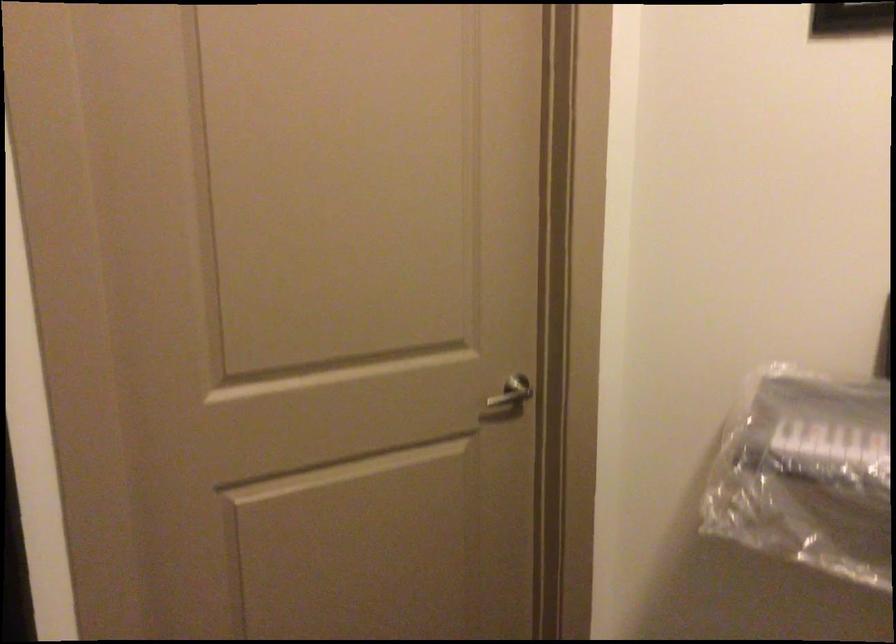
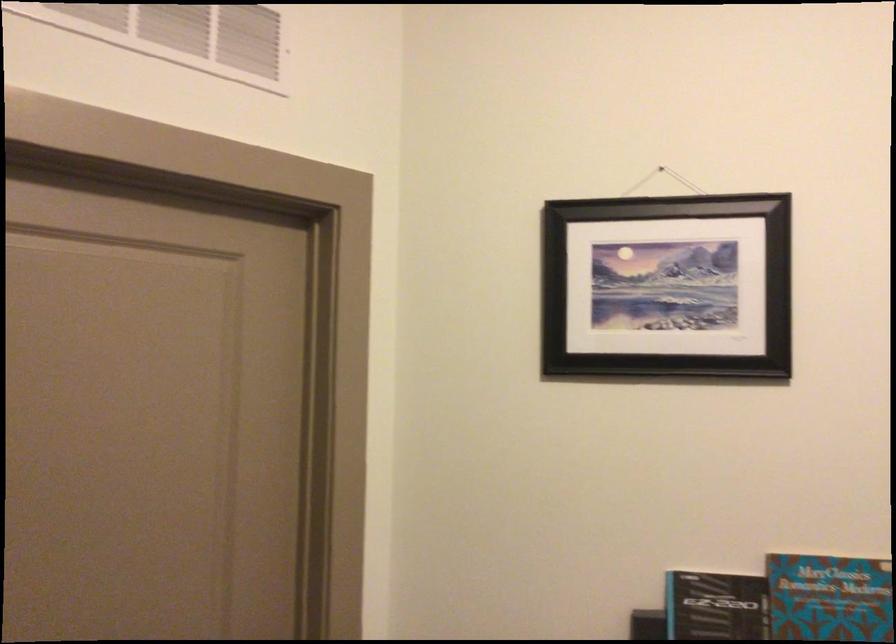
The first image is from the beginning of the video and the second image is from the end. How did the camera likely rotate when shooting the video?

The rotation direction of the camera is right-up.